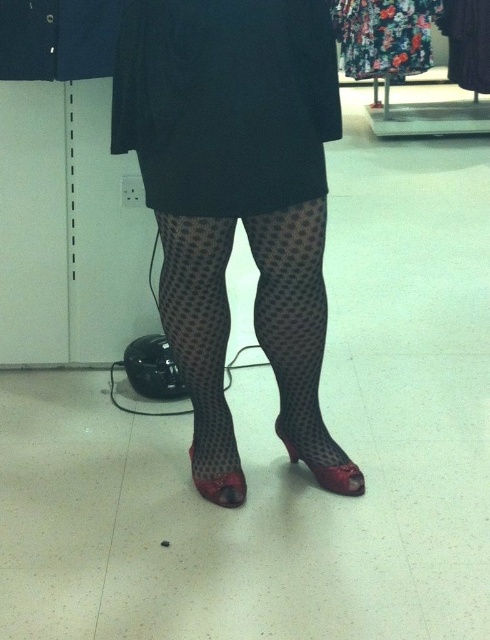
Question: Is black dotted tights at center wider than matte red high-heeled shoe at lower center?

Choices:
 (A) yes
 (B) no

Answer: (A)

Question: Which object is the closest to the matte black shoe at lower center?

Choices:
 (A) floral fabric dress at upper center
 (B) transparent net tights at center
 (C) matte red high-heeled shoe at lower center

Answer: (C)

Question: Does black mesh dress at center appear on the right side of black dotted tights at center?

Choices:
 (A) yes
 (B) no

Answer: (B)

Question: Which of the following is the closest to the observer?

Choices:
 (A) matte red high-heeled shoe at lower center
 (B) floral fabric dress at upper center
 (C) black dotted tights at center
 (D) matte black shoe at lower center

Answer: (C)

Question: Is transparent net tights at center thinner than matte red high-heeled shoe at lower center?

Choices:
 (A) yes
 (B) no

Answer: (B)

Question: Which point is farther from the camera taking this photo?

Choices:
 (A) click(290, 214)
 (B) click(122, 92)
 (C) click(337, 468)

Answer: (C)